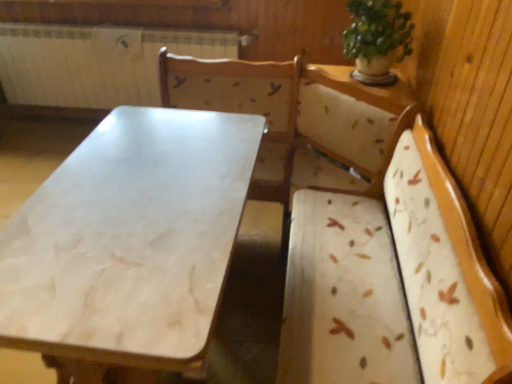
Find the location of a particular element. Image resolution: width=512 pixels, height=384 pixels. free space above white marble table at center (from a real-world perspective) is located at coordinates pos(144,193).